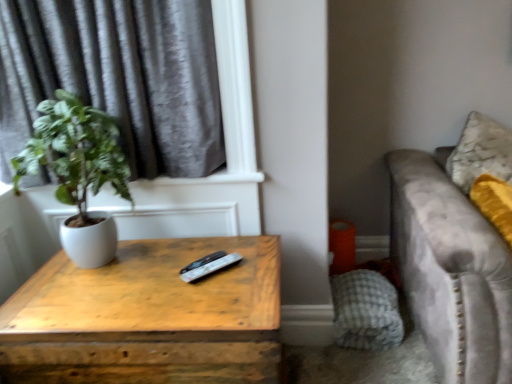
Locate an element on the screen. This screenshot has height=384, width=512. vacant area in front of white matte pot at left is located at coordinates (81, 311).